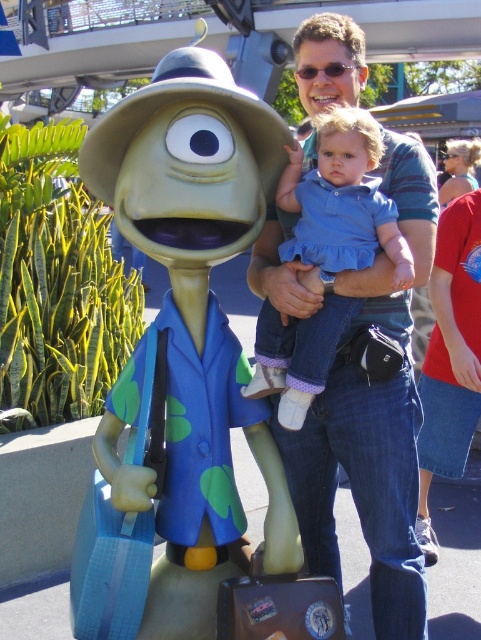
You are a photographer at the amusement park. You need to capture a photo of the matte green plastic alien at center and the denim dress at center. Which object should you focus on first if you want to ensure both are in frame without moving the camera?

The matte green plastic alien at center is wider than the denim dress at center. Therefore, you should focus on the matte green plastic alien at center first to ensure it fits within the frame, as it requires more space.

You are a parent holding a child in a denim dress at center and standing near a matte green plastic alien at center. You want to hand your child to a friend who is 25 centimeters away from you. Can you reach them without moving?

The distance between the matte green plastic alien at center and the denim dress at center is 24.28 centimeters. Since your friend is 25 centimeters away, you are just slightly out of reach and cannot hand the child without moving.

You are a photographer standing at the camera position. You want to take a closeup photo of the matte green plastic alien at center. Can you move closer to it to get a better shot without exceeding the safety distance of 1.5 meters?

The matte green plastic alien at center is 1.58 meters away from camera. Since the safety distance is 1.5 meters, you cannot move closer than that. Therefore, you cannot get closer to the matte green plastic alien at center to take the photo.